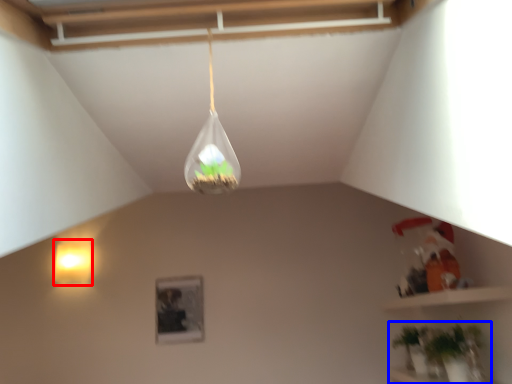
Question: Which of the following is the farthest to the observer, lamp (highlighted by a red box) or houseplant (highlighted by a blue box)?

Choices:
 (A) lamp
 (B) houseplant

Answer: (A)